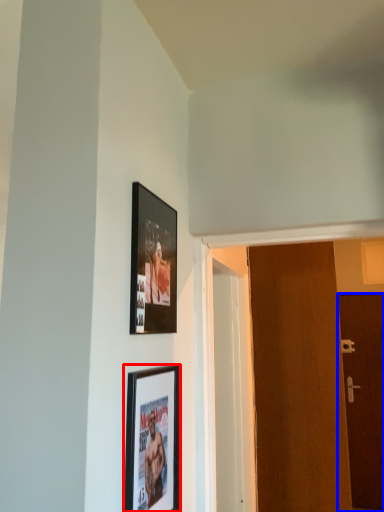
Question: Which object appears farthest to the camera in this image, picture frame (highlighted by a red box) or door (highlighted by a blue box)?

Choices:
 (A) picture frame
 (B) door

Answer: (B)